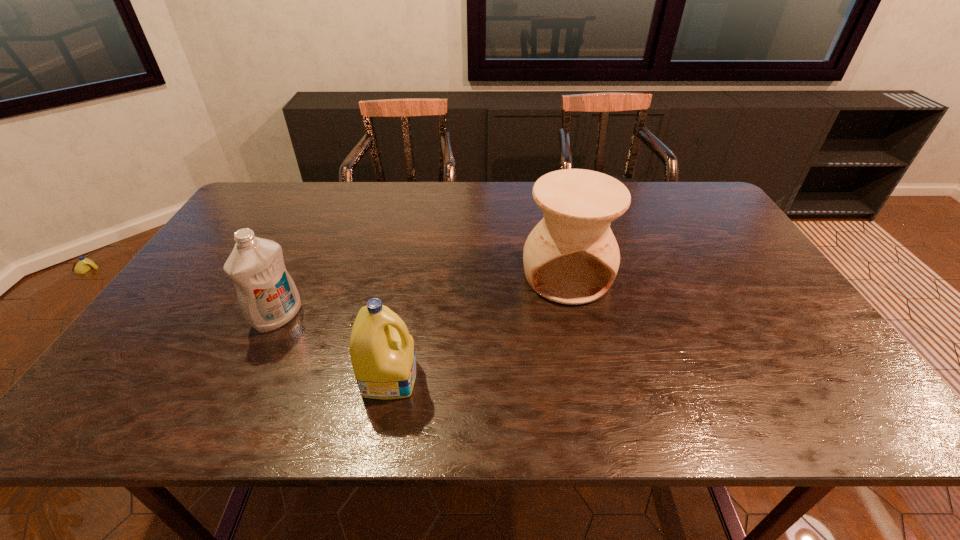
The height and width of the screenshot is (540, 960). I want to click on the rightmost object, so click(571, 257).

Identify the location of the farther detergent. (268, 297).

Locate an element on the screen. the left detergent is located at coordinates (268, 297).

Identify the location of the nearest object. (383, 358).

Where is `the nearer detergent`? Image resolution: width=960 pixels, height=540 pixels. the nearer detergent is located at coordinates (383, 358).

Locate an element on the screen. Image resolution: width=960 pixels, height=540 pixels. free location located 0.270m at the open side of the pottery is located at coordinates (594, 396).

Locate an element on the screen. This screenshot has height=540, width=960. vacant region located on the left of the left detergent is located at coordinates (180, 318).

Where is `vacant point located on the label of the shortest object`? This screenshot has height=540, width=960. vacant point located on the label of the shortest object is located at coordinates (520, 377).

Find the location of `object that is at the near edge`. object that is at the near edge is located at coordinates (383, 358).

Where is `free spot at the far edge of the desktop`? The width and height of the screenshot is (960, 540). free spot at the far edge of the desktop is located at coordinates click(x=441, y=184).